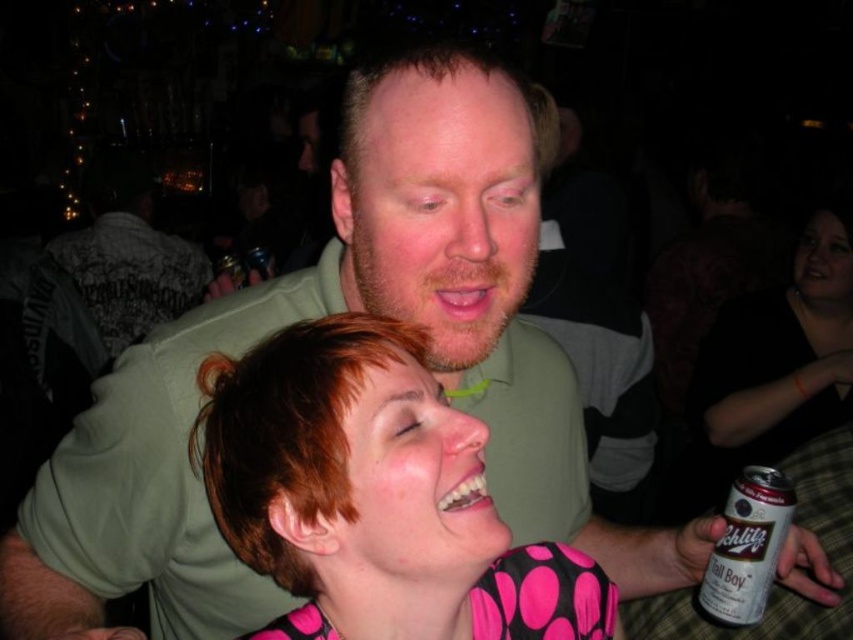
Question: Is pink dotted shirt at center to the left of black matte can at lower right from the viewer's perspective?

Choices:
 (A) no
 (B) yes

Answer: (B)

Question: Is matte green shirt at upper center positioned before silver metallic can at lower right?

Choices:
 (A) no
 (B) yes

Answer: (A)

Question: Which object appears closest to the camera in this image?

Choices:
 (A) matte green shirt at upper center
 (B) pink dotted shirt at center

Answer: (B)

Question: Considering the relative positions of pink dotted shirt at center and black matte can at lower right in the image provided, where is pink dotted shirt at center located with respect to black matte can at lower right?

Choices:
 (A) right
 (B) left

Answer: (B)

Question: Which of the following is the closest to the observer?

Choices:
 (A) matte green shirt at upper center
 (B) black matte can at lower right
 (C) silver metallic can at lower right

Answer: (C)

Question: Estimate the real-world distances between objects in this image. Which object is closer to the pink dotted shirt at center?

Choices:
 (A) matte green shirt at upper center
 (B) black matte can at lower right
 (C) silver metallic can at lower right

Answer: (C)